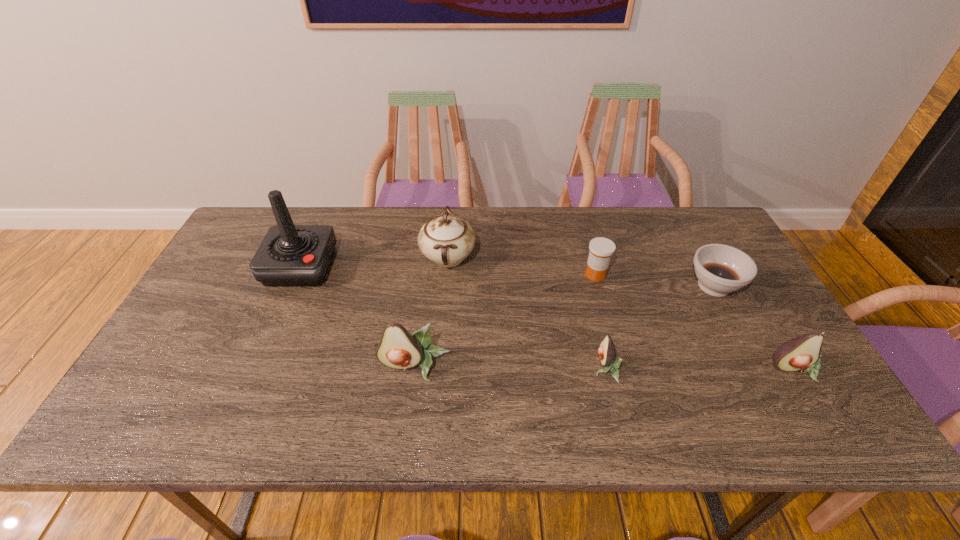
The avocados are evenly distributed in the image. To maintain this, where would you place another avocado on the left? Please point to a free space. Please provide its 2D coordinates. Your answer should be formatted as a tuple, i.e. [(x, y)], where the tuple contains the x and y coordinates of a point satisfying the conditions above.

[(227, 366)]